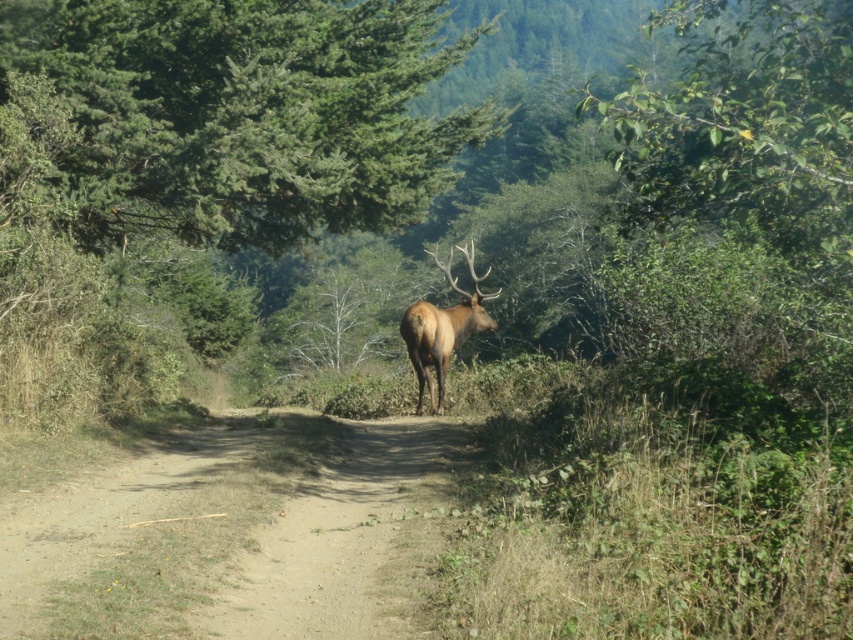
Question: Observing the image, what is the correct spatial positioning of dirt path at center in reference to brown velvet deer at center?

Choices:
 (A) below
 (B) above

Answer: (A)

Question: Which object is positioned closest to the dirt path at center?

Choices:
 (A) brown velvet deer at center
 (B) green needle-like leaves at upper left

Answer: (B)

Question: Is dirt path at center in front of brown velvet deer at center?

Choices:
 (A) no
 (B) yes

Answer: (B)

Question: Can you confirm if green needle-like leaves at upper left is positioned below dirt path at center?

Choices:
 (A) yes
 (B) no

Answer: (B)

Question: Which point is farther to the camera?

Choices:
 (A) (171, 586)
 (B) (437, 368)
 (C) (85, 100)

Answer: (B)

Question: Which object appears closest to the camera in this image?

Choices:
 (A) dirt path at center
 (B) brown velvet deer at center
 (C) green needle-like leaves at upper left

Answer: (A)